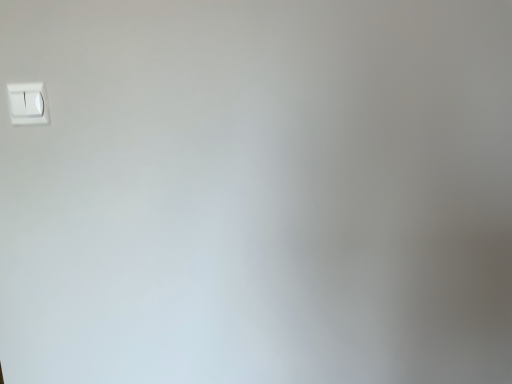
In the scene shown: Measure the distance between point (24, 92) and camera.

A distance of 85.30 centimeters exists between point (24, 92) and camera.

Describe the element at coordinates (28, 104) in the screenshot. I see `white plastic light switch at upper left` at that location.

Image resolution: width=512 pixels, height=384 pixels. I want to click on white plastic light switch at upper left, so click(28, 104).

Locate an element on the screen. This screenshot has height=384, width=512. white plastic light switch at upper left is located at coordinates (28, 104).